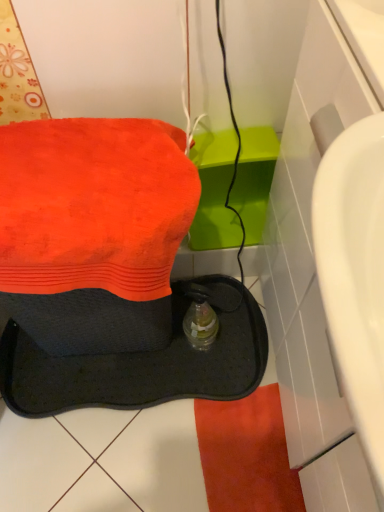
Where is `unoccupied space behind translucent plastic bottle at center`? The height and width of the screenshot is (512, 384). unoccupied space behind translucent plastic bottle at center is located at coordinates (216, 301).